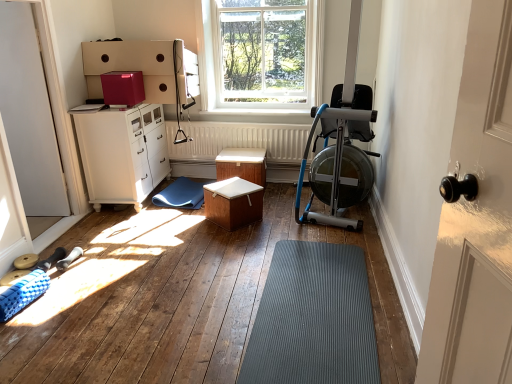
Question: Can clear glass window at upper center be found inside gray rubber mat at center?

Choices:
 (A) no
 (B) yes

Answer: (A)

Question: Is gray rubber mat at center outside of clear glass window at upper center?

Choices:
 (A) yes
 (B) no

Answer: (A)

Question: Can you confirm if gray rubber mat at center is wider than clear glass window at upper center?

Choices:
 (A) yes
 (B) no

Answer: (A)

Question: Can you confirm if gray rubber mat at center is positioned to the right of clear glass window at upper center?

Choices:
 (A) no
 (B) yes

Answer: (B)

Question: Does gray rubber mat at center have a lesser height compared to clear glass window at upper center?

Choices:
 (A) no
 (B) yes

Answer: (B)

Question: Does gray rubber mat at center have a larger size compared to clear glass window at upper center?

Choices:
 (A) no
 (B) yes

Answer: (A)

Question: Is gray rubber mat at center not close to white matte radiator at center?

Choices:
 (A) yes
 (B) no

Answer: (A)

Question: Considering the relative sizes of gray rubber mat at center and white matte radiator at center in the image provided, is gray rubber mat at center thinner than white matte radiator at center?

Choices:
 (A) yes
 (B) no

Answer: (B)

Question: From the image's perspective, is gray rubber mat at center on white matte radiator at center?

Choices:
 (A) yes
 (B) no

Answer: (B)

Question: Is gray rubber mat at center taller than white matte radiator at center?

Choices:
 (A) yes
 (B) no

Answer: (B)

Question: Is gray rubber mat at center not inside white matte radiator at center?

Choices:
 (A) no
 (B) yes

Answer: (B)

Question: Is the position of gray rubber mat at center more distant than that of white matte radiator at center?

Choices:
 (A) no
 (B) yes

Answer: (A)

Question: Is clear glass window at upper center not near blue metallic rowing machine at right?

Choices:
 (A) yes
 (B) no

Answer: (A)